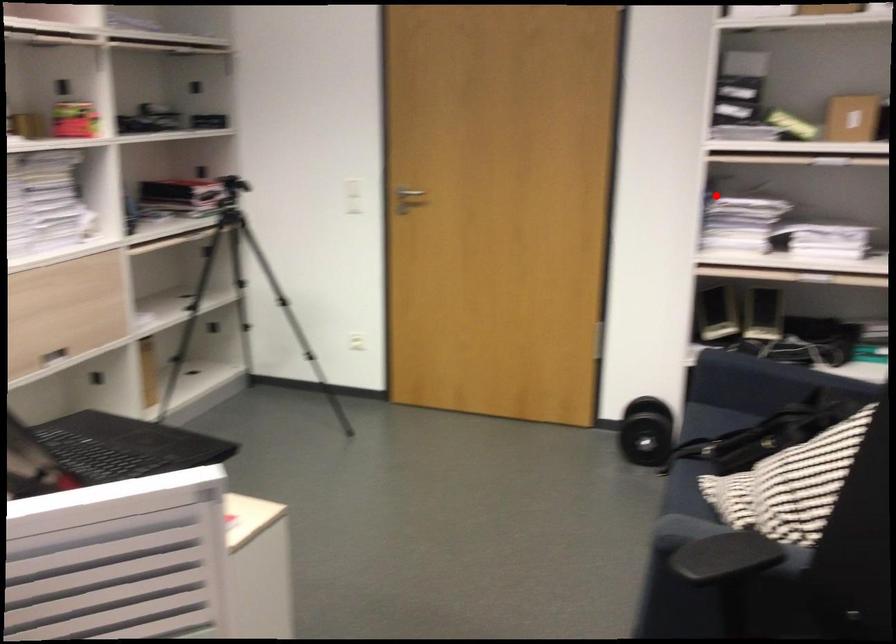
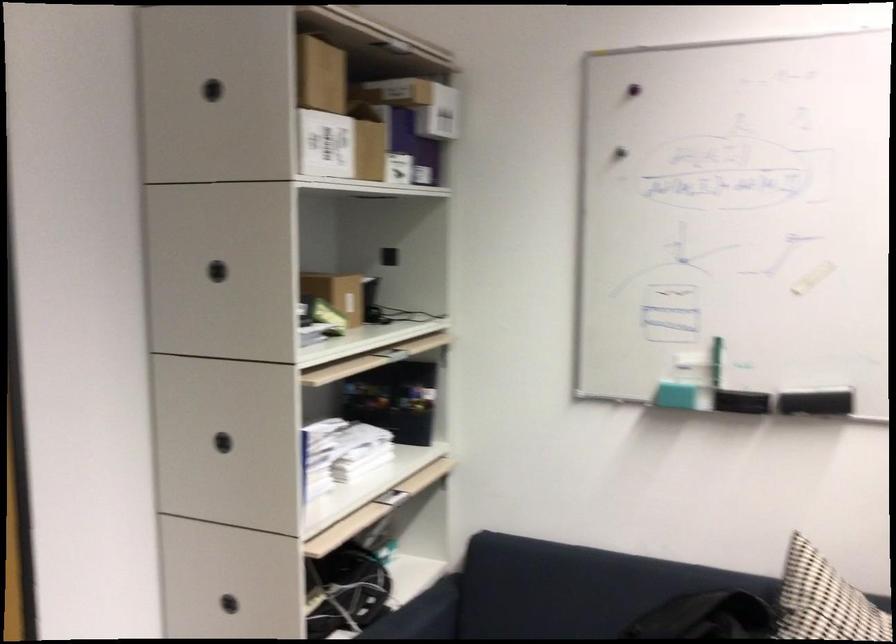
Question: I am providing you with two images of the same scene from different viewpoints. Given a red point in image1, look at the same physical point in image2. Is it:

Choices:
 (A) Closer to the viewpoint
 (B) Farther from the viewpoint

Answer: (A)